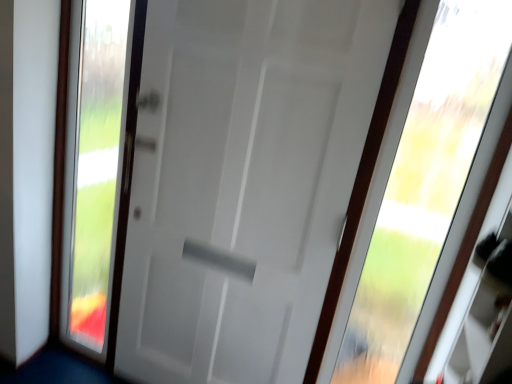
Question: From the image's perspective, is transparent glass door at left above or below transparent glass window at upper right?

Choices:
 (A) below
 (B) above

Answer: (B)

Question: From a real-world perspective, relative to transparent glass window at upper right, is transparent glass door at left vertically above or below?

Choices:
 (A) above
 (B) below

Answer: (B)

Question: Which object is the farthest from the transparent glass window at upper right?

Choices:
 (A) transparent glass door at left
 (B) white matte door at center

Answer: (A)

Question: Considering the real-world distances, which object is closest to the transparent glass window at upper right?

Choices:
 (A) transparent glass door at left
 (B) white matte door at center

Answer: (B)